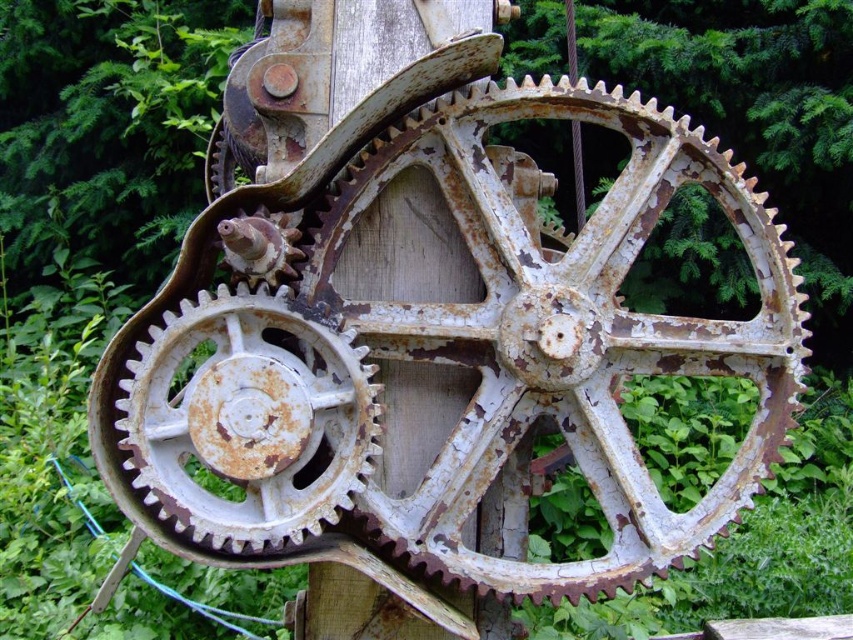
Between rusty metal gear at center and rusty white gear at center, which one appears on the right side from the viewer's perspective?

rusty metal gear at center is more to the right.

Measure the distance between rusty metal gear at center and rusty white gear at center.

25.84 centimeters

Which is in front, point (763, 285) or point (234, 506)?

Point (234, 506) is more forward.

You are a GUI agent. You are given a task and a screenshot of the screen. Output one action in this format:
    pyautogui.click(x=<x>, y=<y>)
    Task: Click on the rusty metal gear at center
    
    Given the screenshot: What is the action you would take?
    pyautogui.click(x=566, y=333)